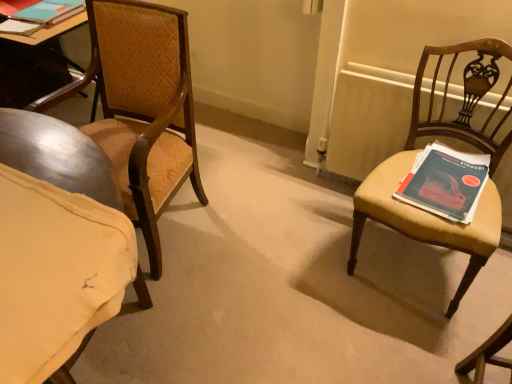
Where is `matte brown chair at right, arranged as the 2th chair when viewed from the left`? This screenshot has height=384, width=512. matte brown chair at right, arranged as the 2th chair when viewed from the left is located at coordinates click(x=407, y=167).

In order to face matte blue book at right, which appears as the first book when viewed from the front, should I rotate leftwards or rightwards?

A 23.653 degree turn to the right will do.

Measure the distance between wooden radiator at right and camera.

5.21 feet.

Identify the location of wooden textured chair at left, acting as the 1th chair starting from the left. This screenshot has width=512, height=384. (141, 107).

Find the location of a particular element. This screenshot has height=384, width=512. matte brown chair at right, arranged as the 2th chair when viewed from the left is located at coordinates (407, 167).

From the image's perspective, is wooden textured chair at left, which ranks as the second chair in right-to-left order, under wooden radiator at right?

No.

Is wooden textured chair at left, which ranks as the second chair in right-to-left order, next to wooden radiator at right and touching it?

No, wooden textured chair at left, which ranks as the second chair in right-to-left order, is not touching wooden radiator at right.

Looking at this image, based on their positions, is wooden textured chair at left, which ranks as the second chair in right-to-left order, located to the left or right of wooden radiator at right?

From the image, it's evident that wooden textured chair at left, which ranks as the second chair in right-to-left order, is to the left of wooden radiator at right.

Locate an element on the screen. The image size is (512, 384). radiator located on the right of wooden textured chair at left, which ranks as the second chair in right-to-left order is located at coordinates (368, 119).

Between wooden radiator at right and wooden textured chair at left, acting as the 1th chair starting from the left, which one appears on the right side from the viewer's perspective?

wooden radiator at right.

From the image's perspective, which one is positioned higher, wooden radiator at right or wooden textured chair at left, acting as the 1th chair starting from the left?

wooden textured chair at left, acting as the 1th chair starting from the left, appears higher in the image.

From the picture: In terms of size, does wooden radiator at right appear bigger or smaller than wooden textured chair at left, which ranks as the second chair in right-to-left order?

Clearly, wooden radiator at right is smaller in size than wooden textured chair at left, which ranks as the second chair in right-to-left order.

Is wooden radiator at right turned away from wooden textured chair at left, which ranks as the second chair in right-to-left order?

No, wooden textured chair at left, which ranks as the second chair in right-to-left order, is not at the back of wooden radiator at right.

Are matte blue book at upper left, the 1th book positioned from the left, and matte brown chair at right, arranged as the 2th chair when viewed from the left, far apart?

Yes, matte blue book at upper left, the 1th book positioned from the left, and matte brown chair at right, arranged as the 2th chair when viewed from the left, are located far from each other.

Looking at this image, from a real-world perspective, is matte blue book at upper left, the 1th book from the top, on top of matte brown chair at right, which is the first chair in right-to-left order?

Yes, from a real-world perspective, matte blue book at upper left, the 1th book from the top, is on top of matte brown chair at right, which is the first chair in right-to-left order.

Which of these two, matte blue book at upper left, placed as the 2th book when sorted from bottom to top, or matte brown chair at right, arranged as the 2th chair when viewed from the left, is smaller?

matte blue book at upper left, placed as the 2th book when sorted from bottom to top, is smaller.

Is matte blue book at upper left, the 1th book from the top, at the right side of matte brown chair at right, arranged as the 2th chair when viewed from the left?

In fact, matte blue book at upper left, the 1th book from the top, is to the left of matte brown chair at right, arranged as the 2th chair when viewed from the left.

Which is less distant, (504,54) or (36,19)?

Point (504,54).

Is matte brown chair at right, arranged as the 2th chair when viewed from the left, taller or shorter than matte blue book at upper left, placed as the 2th book when sorted from bottom to top?

matte brown chair at right, arranged as the 2th chair when viewed from the left, is taller than matte blue book at upper left, placed as the 2th book when sorted from bottom to top.

Considering the sizes of matte brown chair at right, arranged as the 2th chair when viewed from the left, and matte blue book at upper left, the 1th book positioned from the left, in the image, is matte brown chair at right, arranged as the 2th chair when viewed from the left, wider or thinner than matte blue book at upper left, the 1th book positioned from the left,?

Considering their sizes, matte brown chair at right, arranged as the 2th chair when viewed from the left, looks broader than matte blue book at upper left, the 1th book positioned from the left.

From the image's perspective, does matte brown chair at right, arranged as the 2th chair when viewed from the left, appear lower than matte blue book at upper left, the 1th book from the top?

Correct, matte brown chair at right, arranged as the 2th chair when viewed from the left, appears lower than matte blue book at upper left, the 1th book from the top, in the image.

Considering the sizes of objects wooden radiator at right and matte blue book at upper left, the 1th book positioned from the left, in the image provided, who is wider, wooden radiator at right or matte blue book at upper left, the 1th book positioned from the left,?

Wider between the two is matte blue book at upper left, the 1th book positioned from the left.

Is wooden radiator at right taller than matte blue book at upper left, which is counted as the first book, starting from the back?

Correct, wooden radiator at right is much taller as matte blue book at upper left, which is counted as the first book, starting from the back.

Does wooden radiator at right come behind matte blue book at upper left, which is the second book in right-to-left order?

No, it is in front of matte blue book at upper left, which is the second book in right-to-left order.

How different are the orientations of wooden radiator at right and matte blue book at upper left, the 1th book positioned from the left, in degrees?

The angle between the facing direction of wooden radiator at right and the facing direction of matte blue book at upper left, the 1th book positioned from the left, is 3.27 degrees.

Visually, is wooden textured chair at left, which ranks as the second chair in right-to-left order, positioned to the left or to the right of matte blue book at right, which appears as the second book when viewed from the left?

wooden textured chair at left, which ranks as the second chair in right-to-left order, is positioned on matte blue book at right, which appears as the second book when viewed from the left,'s left side.

Is wooden textured chair at left, acting as the 1th chair starting from the left, aimed at matte blue book at right, which is the 2th book from back to front?

No, wooden textured chair at left, acting as the 1th chair starting from the left, is not turned towards matte blue book at right, which is the 2th book from back to front.

From a real-world perspective, count 1st books upward from the wooden textured chair at left, which ranks as the second chair in right-to-left order, and point to it. Please provide its 2D coordinates.

[(445, 182)]

Is point (190, 69) farther from camera compared to point (465, 178)?

Yes, point (190, 69) is behind point (465, 178).

Which is more to the right, matte brown chair at right, arranged as the 2th chair when viewed from the left, or wooden radiator at right?

wooden radiator at right.

From a real-world perspective, which object rests below the other?

wooden radiator at right, from a real-world perspective.

Is matte brown chair at right, which is the first chair in right-to-left order, next to wooden radiator at right and touching it?

They are not placed beside each other.

Who is smaller, matte brown chair at right, which is the first chair in right-to-left order, or wooden radiator at right?

wooden radiator at right is smaller.

Identify the location of chair above the wooden radiator at right (from the image's perspective). Image resolution: width=512 pixels, height=384 pixels. (141, 107).

This screenshot has height=384, width=512. I want to click on the 2nd chair to the left of the wooden radiator at right, starting your count from the anchor, so click(141, 107).

Which object lies nearer to the anchor point matte blue book at upper left, placed as the 2th book when sorted from bottom to top, matte blue book at right, which is the 2th book from back to front, or wooden radiator at right?

Based on the image, wooden radiator at right appears to be nearer to matte blue book at upper left, placed as the 2th book when sorted from bottom to top.

Estimate the real-world distances between objects in this image. Which object is further from wooden radiator at right, matte blue book at upper left, which is counted as the first book, starting from the back, or matte blue book at right, which appears as the first book when viewed from the right?

Based on the image, matte blue book at upper left, which is counted as the first book, starting from the back, appears to be further to wooden radiator at right.

From the picture: Which object lies further to the anchor point matte brown chair at right, which is the first chair in right-to-left order, wooden textured chair at left, acting as the 1th chair starting from the left, or wooden radiator at right?

Based on the image, wooden textured chair at left, acting as the 1th chair starting from the left, appears to be further to matte brown chair at right, which is the first chair in right-to-left order.

Estimate the real-world distances between objects in this image. Which object is further from matte blue book at right, which is the 2th book from back to front, matte blue book at upper left, the 1th book positioned from the left, or wooden radiator at right?

Based on the image, matte blue book at upper left, the 1th book positioned from the left, appears to be further to matte blue book at right, which is the 2th book from back to front.

Estimate the real-world distances between objects in this image. Which object is closer to matte blue book at upper left, which is the second book in right-to-left order, matte brown chair at right, arranged as the 2th chair when viewed from the left, or wooden radiator at right?

Among the two, wooden radiator at right is located nearer to matte blue book at upper left, which is the second book in right-to-left order.

Which object lies nearer to the anchor point matte brown chair at right, arranged as the 2th chair when viewed from the left, wooden radiator at right or wooden textured chair at left, acting as the 1th chair starting from the left?

Based on the image, wooden radiator at right appears to be nearer to matte brown chair at right, arranged as the 2th chair when viewed from the left.

From the image, which object appears to be farther from wooden textured chair at left, which ranks as the second chair in right-to-left order, matte blue book at right, which appears as the first book when viewed from the front, or matte blue book at upper left, placed as the 2th book when sorted from bottom to top?

Among the two, matte blue book at right, which appears as the first book when viewed from the front, is located further to wooden textured chair at left, which ranks as the second chair in right-to-left order.

Considering their positions, is wooden textured chair at left, which ranks as the second chair in right-to-left order, positioned closer to matte blue book at upper left, the 1th book from the top, than wooden radiator at right?

wooden textured chair at left, which ranks as the second chair in right-to-left order.

This screenshot has width=512, height=384. Find the location of `book located between wooden textured chair at left, acting as the 1th chair starting from the left, and wooden radiator at right in the left-right direction`. book located between wooden textured chair at left, acting as the 1th chair starting from the left, and wooden radiator at right in the left-right direction is located at coordinates (445, 182).

This screenshot has height=384, width=512. I want to click on chair located between matte blue book at upper left, placed as the second book when sorted from front to back, and matte brown chair at right, arranged as the 2th chair when viewed from the left, in the left-right direction, so click(x=141, y=107).

Image resolution: width=512 pixels, height=384 pixels. I want to click on chair located between wooden textured chair at left, acting as the 1th chair starting from the left, and matte blue book at right, which appears as the first book when viewed from the right, in the left-right direction, so click(407, 167).

Locate an element on the screen. book located between matte brown chair at right, arranged as the 2th chair when viewed from the left, and wooden radiator at right in the depth direction is located at coordinates (445, 182).